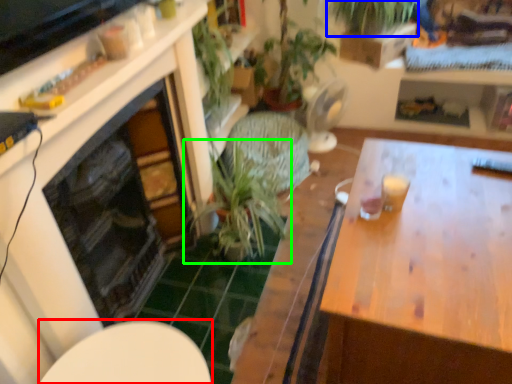
Question: Which is nearer to the round table (highlighted by a red box)? vegetation (highlighted by a blue box) or houseplant (highlighted by a green box).

Choices:
 (A) vegetation
 (B) houseplant

Answer: (B)